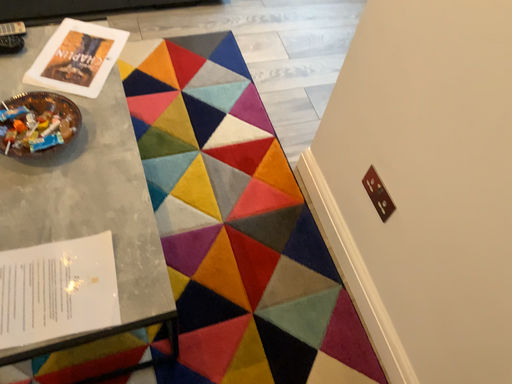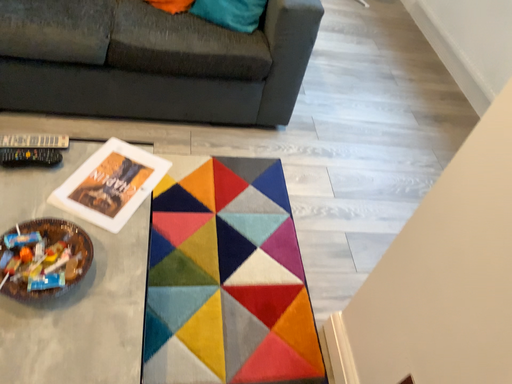
Question: Which way did the camera rotate in the video?

Choices:
 (A) rotated downward
 (B) rotated upward

Answer: (B)